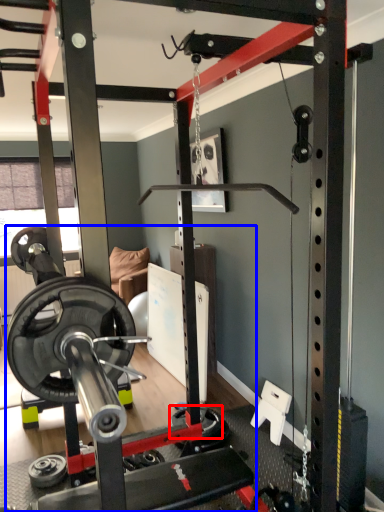
Question: Which point is closer to the camera, wheel (highlighted by a red box) or barbell (highlighted by a blue box)?

Choices:
 (A) wheel
 (B) barbell

Answer: (B)